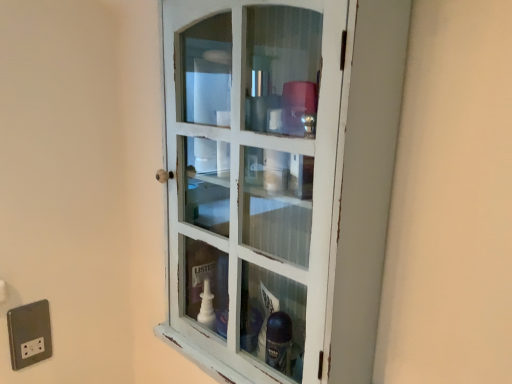
Find the location of a particular element. The width and height of the screenshot is (512, 384). silver metallic outlet at lower left is located at coordinates (29, 334).

The image size is (512, 384). Describe the element at coordinates (29, 334) in the screenshot. I see `silver metallic outlet at lower left` at that location.

Describe the element at coordinates (280, 182) in the screenshot. I see `white distressed wood cabinet at center` at that location.

Where is `white distressed wood cabinet at center`? white distressed wood cabinet at center is located at coordinates (280, 182).

The width and height of the screenshot is (512, 384). Find the location of `silver metallic outlet at lower left`. silver metallic outlet at lower left is located at coordinates (29, 334).

Is white distressed wood cabinet at center to the left or to the right of silver metallic outlet at lower left in the image?

From the image, it's evident that white distressed wood cabinet at center is to the right of silver metallic outlet at lower left.

Is white distressed wood cabinet at center further to the viewer compared to silver metallic outlet at lower left?

No, white distressed wood cabinet at center is closer to the camera.

Is point (286, 351) behind point (38, 356)?

That is False.

From the image's perspective, which one is positioned higher, white distressed wood cabinet at center or silver metallic outlet at lower left?

white distressed wood cabinet at center.

From a real-world perspective, which object stands above the other?

white distressed wood cabinet at center, from a real-world perspective.

Considering the relative sizes of white distressed wood cabinet at center and silver metallic outlet at lower left in the image provided, is white distressed wood cabinet at center thinner than silver metallic outlet at lower left?

In fact, white distressed wood cabinet at center might be wider than silver metallic outlet at lower left.

Between white distressed wood cabinet at center and silver metallic outlet at lower left, which one has less height?

silver metallic outlet at lower left.

Looking at the image, does white distressed wood cabinet at center seem bigger or smaller compared to silver metallic outlet at lower left?

Clearly, white distressed wood cabinet at center is larger in size than silver metallic outlet at lower left.

Is silver metallic outlet at lower left a part of white distressed wood cabinet at center?

No, white distressed wood cabinet at center does not contain silver metallic outlet at lower left.

Is white distressed wood cabinet at center not near silver metallic outlet at lower left?

That's not correct — white distressed wood cabinet at center is a little close to silver metallic outlet at lower left.

Is white distressed wood cabinet at center facing away from silver metallic outlet at lower left?

No, white distressed wood cabinet at center is not facing away from silver metallic outlet at lower left.

The height and width of the screenshot is (384, 512). I want to click on electric outlet behind the white distressed wood cabinet at center, so click(x=29, y=334).

Does silver metallic outlet at lower left appear on the left side of white distressed wood cabinet at center?

Indeed, silver metallic outlet at lower left is positioned on the left side of white distressed wood cabinet at center.

In the image, is silver metallic outlet at lower left positioned in front of or behind white distressed wood cabinet at center?

silver metallic outlet at lower left is positioned farther from the viewer than white distressed wood cabinet at center.

Which is in front, point (39, 313) or point (177, 153)?

The point (177, 153) is closer.

From the image's perspective, which one is positioned lower, silver metallic outlet at lower left or white distressed wood cabinet at center?

silver metallic outlet at lower left.

From the picture: From a real-world perspective, is silver metallic outlet at lower left physically below white distressed wood cabinet at center?

Indeed, from a real-world perspective, silver metallic outlet at lower left is positioned beneath white distressed wood cabinet at center.

Can you confirm if silver metallic outlet at lower left is wider than white distressed wood cabinet at center?

No, silver metallic outlet at lower left is not wider than white distressed wood cabinet at center.

Can you confirm if silver metallic outlet at lower left is shorter than white distressed wood cabinet at center?

Indeed, silver metallic outlet at lower left has a lesser height compared to white distressed wood cabinet at center.

Is silver metallic outlet at lower left bigger or smaller than white distressed wood cabinet at center?

Clearly, silver metallic outlet at lower left is smaller in size than white distressed wood cabinet at center.

Is silver metallic outlet at lower left positioned beyond the bounds of white distressed wood cabinet at center?

Absolutely, silver metallic outlet at lower left is external to white distressed wood cabinet at center.

Is silver metallic outlet at lower left not near white distressed wood cabinet at center?

No, silver metallic outlet at lower left is not far from white distressed wood cabinet at center.

Is silver metallic outlet at lower left positioned with its back to white distressed wood cabinet at center?

No, silver metallic outlet at lower left's orientation is not away from white distressed wood cabinet at center.

How many degrees apart are the facing directions of silver metallic outlet at lower left and white distressed wood cabinet at center?

silver metallic outlet at lower left and white distressed wood cabinet at center are facing 90.2 degrees away from each other.

How much distance is there between silver metallic outlet at lower left and white distressed wood cabinet at center?

They are 25.03 inches apart.

The height and width of the screenshot is (384, 512). In order to click on electric outlet below the white distressed wood cabinet at center (from a real-world perspective) in this screenshot , I will do (x=29, y=334).

Image resolution: width=512 pixels, height=384 pixels. I want to click on cupboard in front of the silver metallic outlet at lower left, so click(x=280, y=182).

Where is `electric outlet below the white distressed wood cabinet at center (from a real-world perspective)`? The image size is (512, 384). electric outlet below the white distressed wood cabinet at center (from a real-world perspective) is located at coordinates (29, 334).